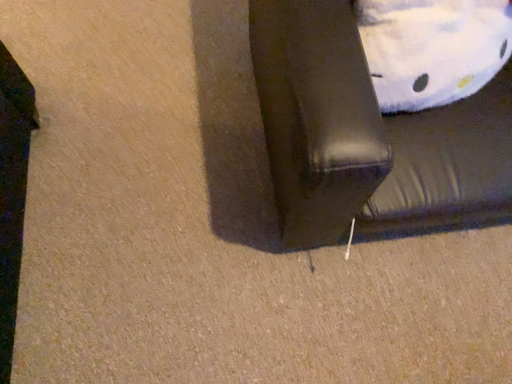
Question: From a real-world perspective, is black leather couch at lower right located higher than white plush pillow at upper right?

Choices:
 (A) no
 (B) yes

Answer: (A)

Question: Is black leather couch at lower right shorter than white plush pillow at upper right?

Choices:
 (A) no
 (B) yes

Answer: (A)

Question: Is white plush pillow at upper right a part of black leather couch at lower right?

Choices:
 (A) no
 (B) yes

Answer: (B)

Question: Are black leather couch at lower right and white plush pillow at upper right beside each other?

Choices:
 (A) yes
 (B) no

Answer: (B)

Question: Considering the relative positions of black leather couch at lower right and white plush pillow at upper right in the image provided, is black leather couch at lower right to the right of white plush pillow at upper right from the viewer's perspective?

Choices:
 (A) no
 (B) yes

Answer: (B)

Question: Is black leather couch at lower right located outside white plush pillow at upper right?

Choices:
 (A) no
 (B) yes

Answer: (B)

Question: Can you confirm if white plush pillow at upper right is bigger than black leather couch at lower right?

Choices:
 (A) yes
 (B) no

Answer: (B)

Question: Is white plush pillow at upper right further to the viewer compared to black leather couch at lower right?

Choices:
 (A) yes
 (B) no

Answer: (A)

Question: Can you confirm if white plush pillow at upper right is smaller than black leather couch at lower right?

Choices:
 (A) yes
 (B) no

Answer: (A)

Question: Is white plush pillow at upper right located outside black leather couch at lower right?

Choices:
 (A) no
 (B) yes

Answer: (A)

Question: From a real-world perspective, is white plush pillow at upper right positioned under black leather couch at lower right based on gravity?

Choices:
 (A) yes
 (B) no

Answer: (B)

Question: Does white plush pillow at upper right appear on the right side of black leather couch at lower right?

Choices:
 (A) no
 (B) yes

Answer: (A)

Question: In the image, is white plush pillow at upper right on the left side or the right side of black leather couch at lower right?

Choices:
 (A) right
 (B) left

Answer: (B)